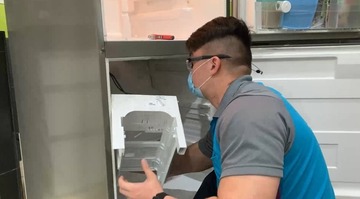
You are a GUI agent. You are given a task and a screenshot of the screen. Output one action in this format:
    pyautogui.click(x=<x>, y=<y>)
    Task: Click on the shelf
    
    Given the screenshot: What is the action you would take?
    pyautogui.click(x=323, y=17)